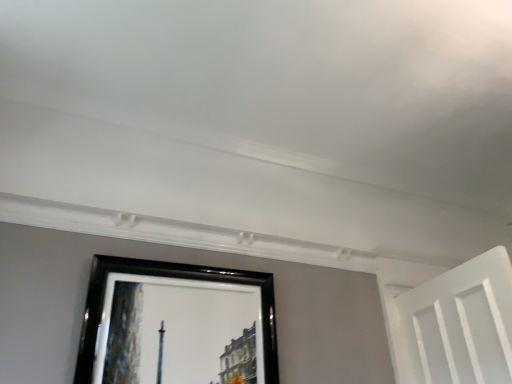
What do you see at coordinates (176, 324) in the screenshot? This screenshot has height=384, width=512. I see `black glossy picture frame at center` at bounding box center [176, 324].

Find the location of a particular element. black glossy picture frame at center is located at coordinates (176, 324).

Locate an element on the screen. The width and height of the screenshot is (512, 384). black glossy picture frame at center is located at coordinates (176, 324).